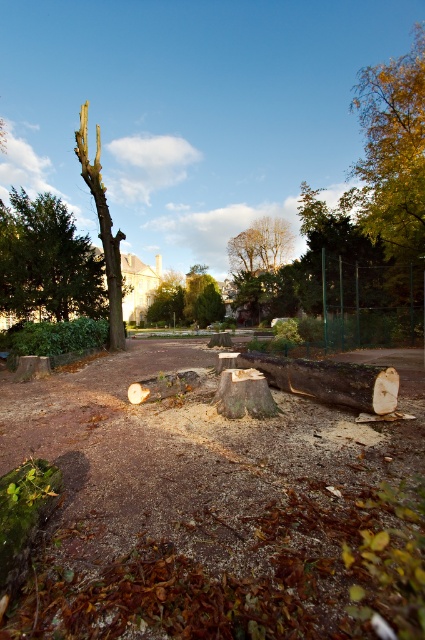
Can you confirm if green matte tree at upper left is positioned to the left of smooth brown tree trunk at left?

Incorrect, green matte tree at upper left is not on the left side of smooth brown tree trunk at left.

What do you see at coordinates (47, 260) in the screenshot?
I see `green matte tree at upper left` at bounding box center [47, 260].

I want to click on green matte tree at upper left, so click(x=47, y=260).

Which of these two, brown rough wood log at center or green leafy tree at center, stands shorter?

With less height is brown rough wood log at center.

Is brown rough wood log at center thinner than green leafy tree at center?

Indeed, brown rough wood log at center has a lesser width compared to green leafy tree at center.

Where is `brown rough wood log at center`? The image size is (425, 640). brown rough wood log at center is located at coordinates (328, 380).

Where is `brown rough wood log at center`? This screenshot has height=640, width=425. brown rough wood log at center is located at coordinates pyautogui.click(x=328, y=380).

Is green matte tree at upper left wider than green leafy tree at center?

In fact, green matte tree at upper left might be narrower than green leafy tree at center.

Is point (48, 198) positioned behind point (206, 316)?

No, (48, 198) is in front of (206, 316).

Locate an element on the screen. The image size is (425, 640). green matte tree at upper left is located at coordinates (47, 260).